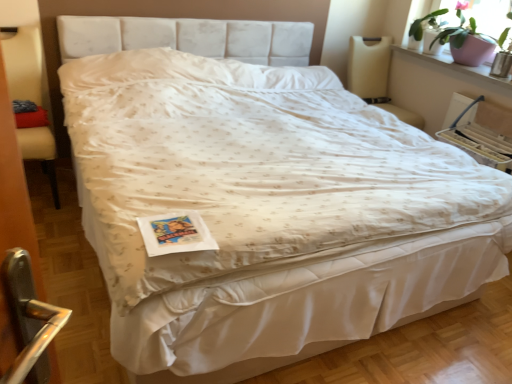
Question: Considering the positions of green matte plant at upper right and pink ceramic pot at upper right in the image, is green matte plant at upper right wider or thinner than pink ceramic pot at upper right?

Choices:
 (A) wide
 (B) thin

Answer: (B)

Question: Is green matte plant at upper right to the left or to the right of pink ceramic pot at upper right in the image?

Choices:
 (A) right
 (B) left

Answer: (B)

Question: Considering the real-world distances, which object is closest to the pink ceramic pot at upper right?

Choices:
 (A) pink ceramic pot at upper right
 (B) beige fabric armchair at left
 (C) green matte plant at upper right

Answer: (C)

Question: Estimate the real-world distances between objects in this image. Which object is farther from the beige fabric armchair at left?

Choices:
 (A) green matte plant at upper right
 (B) pink ceramic pot at upper right
 (C) pink ceramic pot at upper right

Answer: (A)